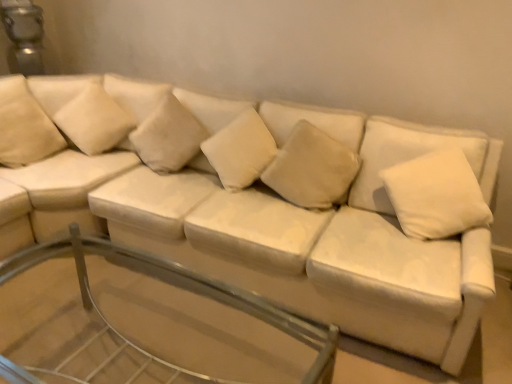
Question: From the image's perspective, would you say white soft cushion at upper left, marked as the second pillow in a left-to-right arrangement, is positioned over white soft cushion at center, which ranks as the fourth pillow in left-to-right order?

Choices:
 (A) yes
 (B) no

Answer: (A)

Question: Would you say white soft cushion at upper left, marked as the second pillow in a left-to-right arrangement, is outside white soft cushion at center, placed as the 3th pillow when sorted from right to left?

Choices:
 (A) yes
 (B) no

Answer: (A)

Question: Is there a large distance between white soft cushion at upper left, the 5th pillow viewed from the right, and white soft cushion at center, placed as the 3th pillow when sorted from right to left?

Choices:
 (A) no
 (B) yes

Answer: (A)

Question: From the image's perspective, does white soft cushion at upper left, the 5th pillow viewed from the right, appear lower than white soft cushion at center, which ranks as the fourth pillow in left-to-right order?

Choices:
 (A) no
 (B) yes

Answer: (A)

Question: Is white soft cushion at upper left, marked as the second pillow in a left-to-right arrangement, positioned with its back to white soft cushion at center, which ranks as the fourth pillow in left-to-right order?

Choices:
 (A) yes
 (B) no

Answer: (B)

Question: In the image, is suede-like beige pillow at upper left, which is the 6th pillow in right-to-left order, on the left side or the right side of white soft cushion at center, placed as the 3th pillow when sorted from right to left?

Choices:
 (A) right
 (B) left

Answer: (B)

Question: From the image's perspective, relative to white soft cushion at center, placed as the 3th pillow when sorted from right to left, is suede-like beige pillow at upper left, the 1th pillow when ordered from left to right, above or below?

Choices:
 (A) above
 (B) below

Answer: (A)

Question: In terms of width, does suede-like beige pillow at upper left, the 1th pillow when ordered from left to right, look wider or thinner when compared to white soft cushion at center, which ranks as the fourth pillow in left-to-right order?

Choices:
 (A) thin
 (B) wide

Answer: (A)

Question: In the image, is suede-like beige pillow at upper left, which is the 6th pillow in right-to-left order, positioned in front of or behind white soft cushion at center, placed as the 3th pillow when sorted from right to left?

Choices:
 (A) front
 (B) behind

Answer: (B)

Question: Considering their positions, is beige fabric pillow at center, which ranks as the 3th pillow in left-to-right order, located in front of or behind white soft pillow at upper right, the 6th pillow viewed from the left?

Choices:
 (A) front
 (B) behind

Answer: (B)

Question: From a real-world perspective, is beige fabric pillow at center, the fourth pillow viewed from the right, physically located above or below white soft pillow at upper right, the 6th pillow viewed from the left?

Choices:
 (A) above
 (B) below

Answer: (B)

Question: From their relative heights in the image, would you say beige fabric pillow at center, the fourth pillow viewed from the right, is taller or shorter than white soft pillow at upper right, acting as the 1th pillow starting from the right?

Choices:
 (A) tall
 (B) short

Answer: (B)

Question: From the image's perspective, is beige fabric pillow at center, the fourth pillow viewed from the right, above or below white soft pillow at upper right, acting as the 1th pillow starting from the right?

Choices:
 (A) below
 (B) above

Answer: (B)

Question: Is white soft pillow at upper right, the 6th pillow viewed from the left, in front of or behind transparent glass table at center in the image?

Choices:
 (A) front
 (B) behind

Answer: (B)

Question: Considering the positions of white soft pillow at upper right, the 6th pillow viewed from the left, and transparent glass table at center in the image, is white soft pillow at upper right, the 6th pillow viewed from the left, wider or thinner than transparent glass table at center?

Choices:
 (A) wide
 (B) thin

Answer: (B)